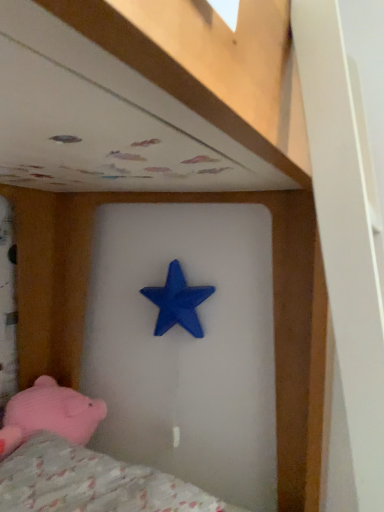
Question: Can you confirm if pink plush pig at lower left is thinner than fluffy pink fabric at lower left?

Choices:
 (A) yes
 (B) no

Answer: (A)

Question: Is pink plush pig at lower left at the right side of fluffy pink fabric at lower left?

Choices:
 (A) no
 (B) yes

Answer: (A)

Question: Is pink plush pig at lower left positioned in front of fluffy pink fabric at lower left?

Choices:
 (A) no
 (B) yes

Answer: (A)

Question: Is pink plush pig at lower left shorter than fluffy pink fabric at lower left?

Choices:
 (A) yes
 (B) no

Answer: (B)

Question: Is pink plush pig at lower left next to fluffy pink fabric at lower left?

Choices:
 (A) no
 (B) yes

Answer: (A)

Question: Is blue matte star at center wider or thinner than pink plush pig at lower left?

Choices:
 (A) wide
 (B) thin

Answer: (B)

Question: Which is correct: blue matte star at center is inside pink plush pig at lower left, or outside of it?

Choices:
 (A) inside
 (B) outside

Answer: (B)

Question: Does point (178, 324) appear closer or farther from the camera than point (21, 404)?

Choices:
 (A) farther
 (B) closer

Answer: (A)

Question: Relative to pink plush pig at lower left, is blue matte star at center in front or behind?

Choices:
 (A) behind
 (B) front

Answer: (A)

Question: In terms of size, does blue matte star at center appear bigger or smaller than fluffy pink fabric at lower left?

Choices:
 (A) big
 (B) small

Answer: (B)

Question: From the image's perspective, relative to fluffy pink fabric at lower left, is blue matte star at center above or below?

Choices:
 (A) below
 (B) above

Answer: (B)

Question: Visually, is blue matte star at center positioned to the left or to the right of fluffy pink fabric at lower left?

Choices:
 (A) left
 (B) right

Answer: (B)

Question: Is blue matte star at center in front of or behind fluffy pink fabric at lower left in the image?

Choices:
 (A) front
 (B) behind

Answer: (B)

Question: Is point (157, 501) positioned closer to the camera than point (173, 260)?

Choices:
 (A) closer
 (B) farther

Answer: (A)

Question: From the image's perspective, relative to blue matte star at center, is fluffy pink fabric at lower left above or below?

Choices:
 (A) below
 (B) above

Answer: (A)